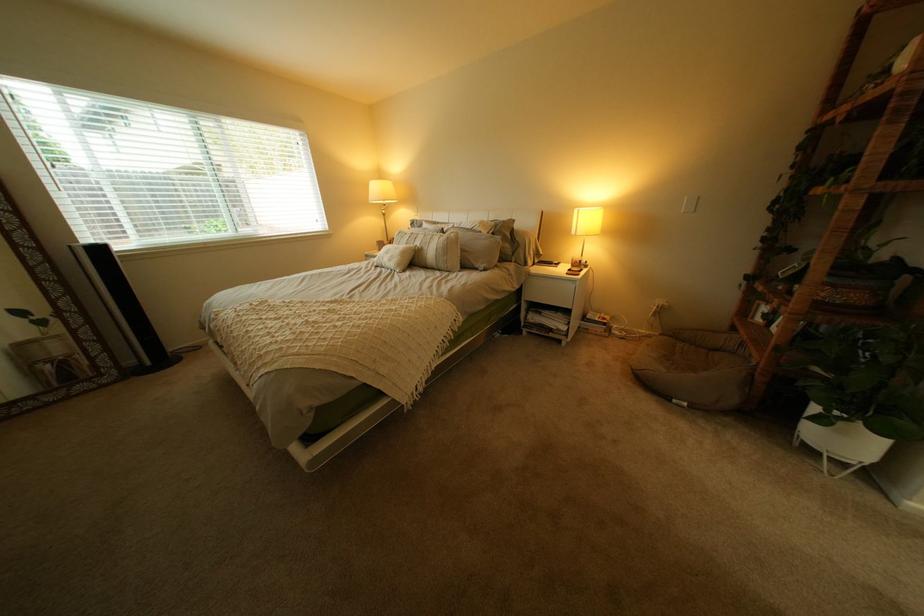
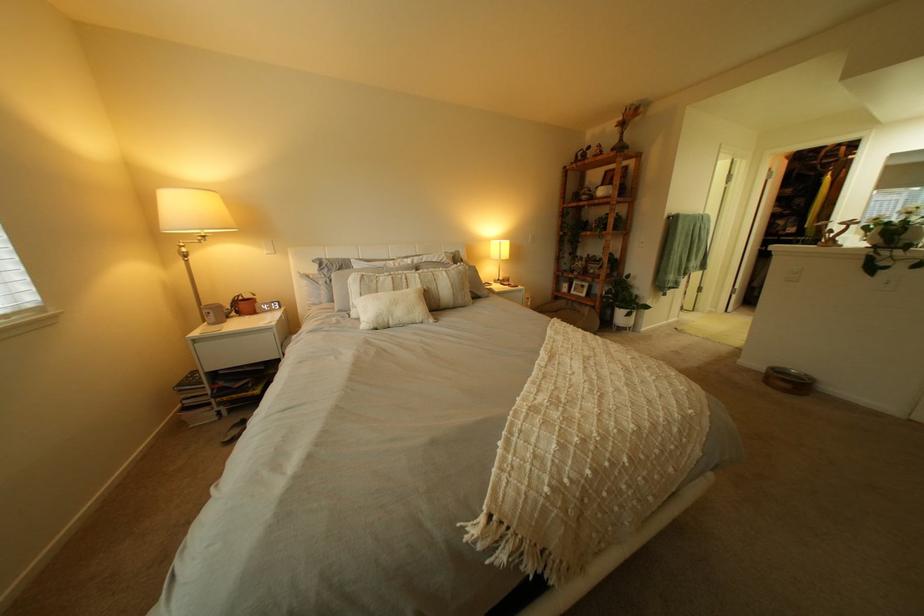
Find the pixel in the second image that matches [435,243] in the first image.

(434, 283)